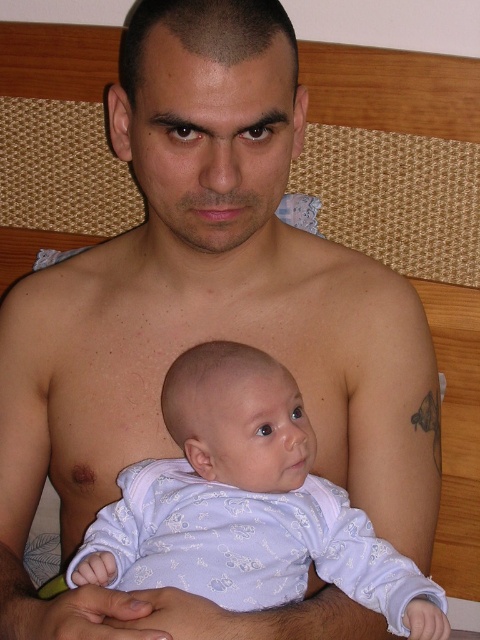
Is wooden headboard at upper center above light purple fabric baby at center?

Indeed, wooden headboard at upper center is positioned over light purple fabric baby at center.

Who is taller, wooden headboard at upper center or light purple fabric baby at center?

wooden headboard at upper center is taller.

Is point (3, 221) closer to viewer compared to point (334, 524)?

No, it is behind (334, 524).

You are a GUI agent. You are given a task and a screenshot of the screen. Output one action in this format:
    pyautogui.click(x=<x>, y=<y>)
    Task: Click on the wooden headboard at upper center
    The image size is (480, 640).
    Given the screenshot: What is the action you would take?
    pyautogui.click(x=395, y=156)